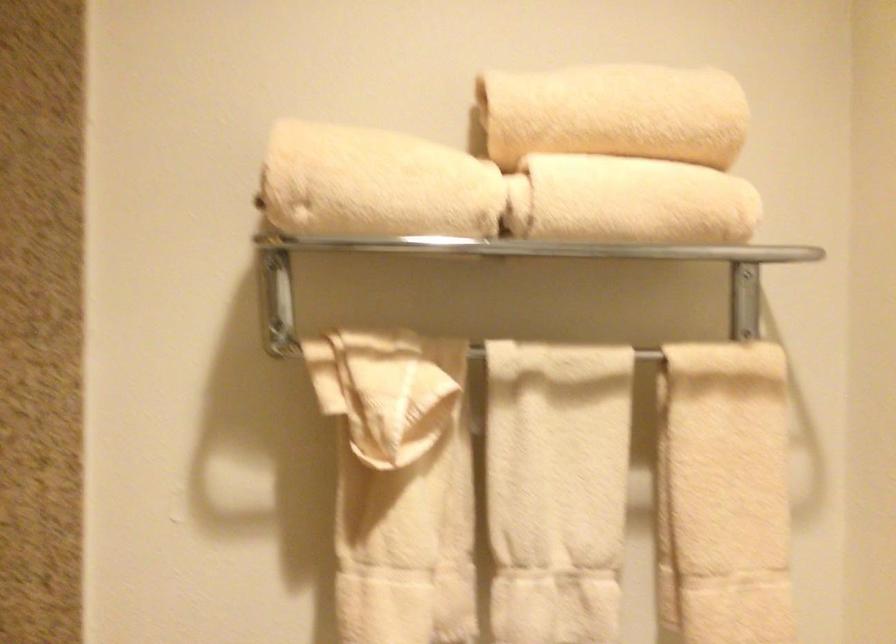
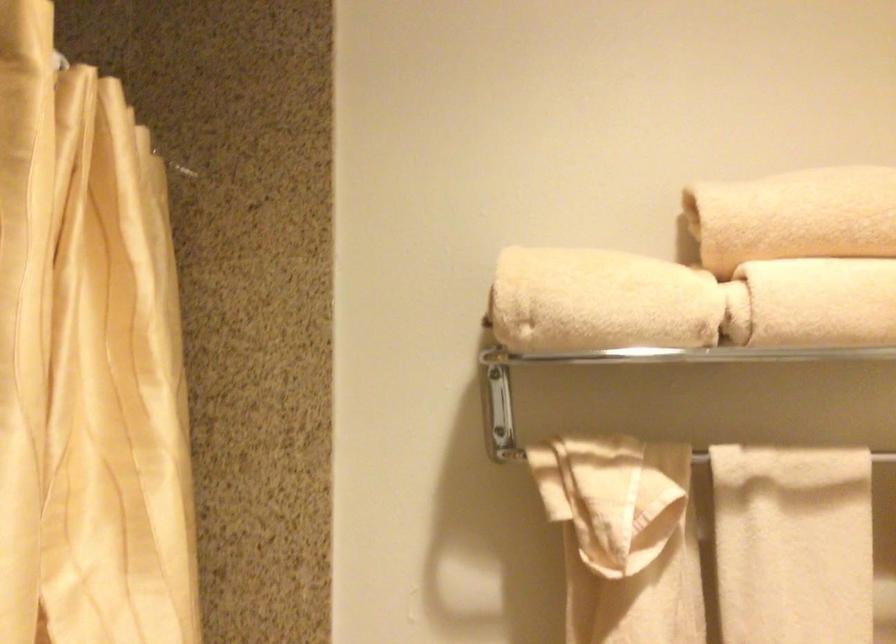
Find the pixel in the second image that matches [376,184] in the first image.

(599, 301)